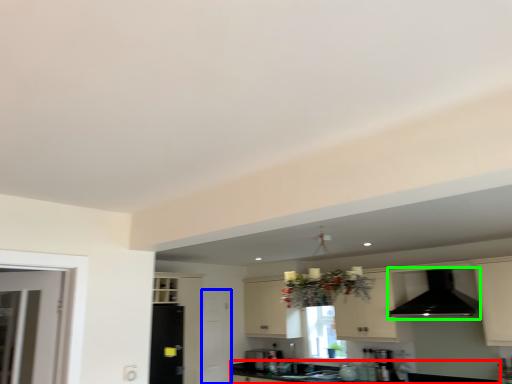
Question: Based on their relative distances, which object is farther from countertop (highlighted by a red box)? Choose from screen door (highlighted by a blue box) and exhaust hood (highlighted by a green box).

Choices:
 (A) screen door
 (B) exhaust hood

Answer: (B)